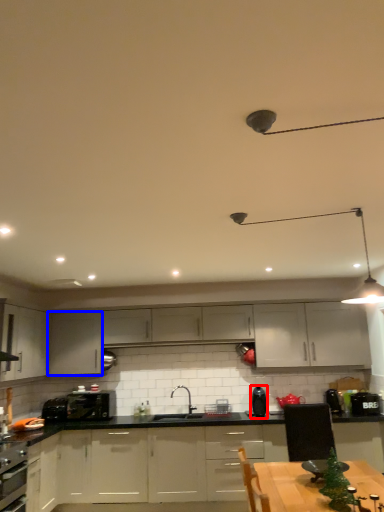
Question: Which of the following is the closest to the observer, kitchen appliance (highlighted by a red box) or cabinetry (highlighted by a blue box)?

Choices:
 (A) kitchen appliance
 (B) cabinetry

Answer: (A)